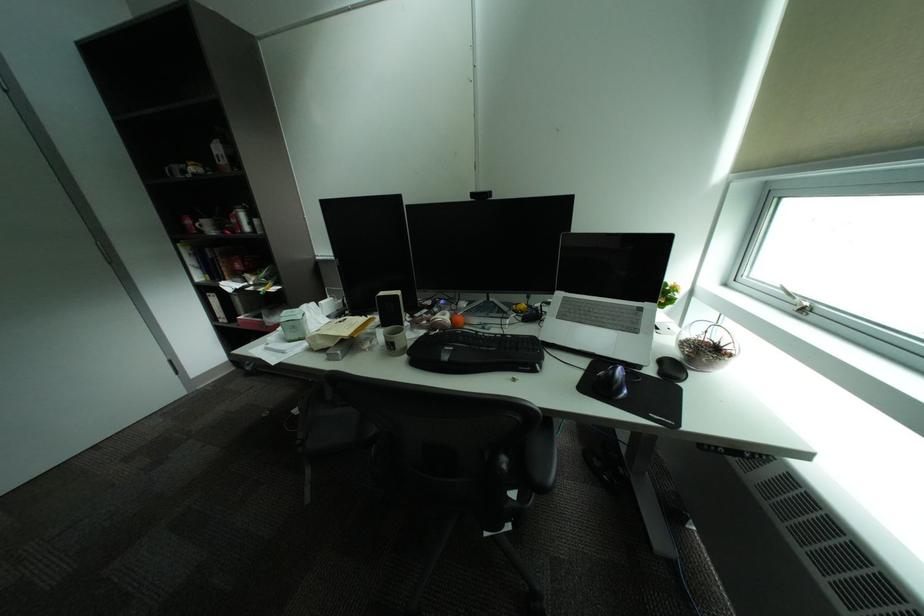
At what (x,y) coordinates should I click in order to perform the action: click on black ergonomic keyboard. Please return your answer as a coordinate pair (x, y). Image resolution: width=924 pixels, height=616 pixels. Looking at the image, I should click on (475, 352).